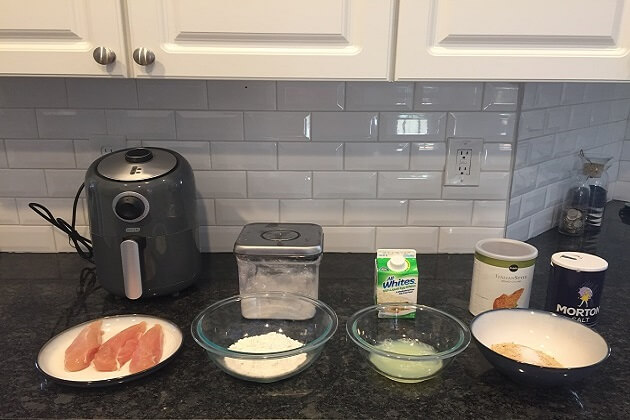
What are the coordinates of `white cabinets` in the screenshot? It's located at 348,48, 487,58, 67,24.